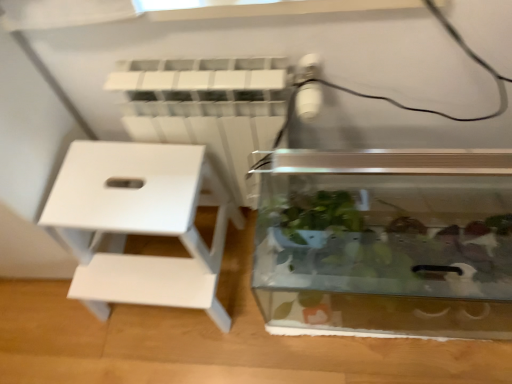
Question: From a real-world perspective, is white plastic radiator at upper center located higher than white matte stool at left?

Choices:
 (A) yes
 (B) no

Answer: (A)

Question: Is white plastic radiator at upper center far away from white matte stool at left?

Choices:
 (A) yes
 (B) no

Answer: (B)

Question: Considering the relative sizes of white plastic radiator at upper center and white matte stool at left in the image provided, is white plastic radiator at upper center taller than white matte stool at left?

Choices:
 (A) no
 (B) yes

Answer: (B)

Question: Does white plastic radiator at upper center have a lesser width compared to white matte stool at left?

Choices:
 (A) yes
 (B) no

Answer: (A)

Question: Is white plastic radiator at upper center turned away from white matte stool at left?

Choices:
 (A) no
 (B) yes

Answer: (A)

Question: In the image, is white matte stool at left positioned in front of or behind transparent glass tank at center?

Choices:
 (A) front
 (B) behind

Answer: (B)

Question: Is white matte stool at left taller or shorter than transparent glass tank at center?

Choices:
 (A) tall
 (B) short

Answer: (A)

Question: Is point (124, 221) positioned closer to the camera than point (287, 215)?

Choices:
 (A) farther
 (B) closer

Answer: (B)

Question: Visually, is white matte stool at left positioned to the left or to the right of transparent glass tank at center?

Choices:
 (A) right
 (B) left

Answer: (B)

Question: Is white matte stool at left spatially inside white plastic radiator at upper center, or outside of it?

Choices:
 (A) inside
 (B) outside

Answer: (B)

Question: From a real-world perspective, relative to white plastic radiator at upper center, is white matte stool at left vertically above or below?

Choices:
 (A) above
 (B) below

Answer: (B)

Question: Looking at the image, does white matte stool at left seem bigger or smaller compared to white plastic radiator at upper center?

Choices:
 (A) big
 (B) small

Answer: (A)

Question: In the image, is white matte stool at left on the left side or the right side of white plastic radiator at upper center?

Choices:
 (A) right
 (B) left

Answer: (B)

Question: Relative to white matte stool at left, is transparent glass tank at center in front or behind?

Choices:
 (A) behind
 (B) front

Answer: (B)

Question: From the image's perspective, is transparent glass tank at center located above or below white matte stool at left?

Choices:
 (A) below
 (B) above

Answer: (A)